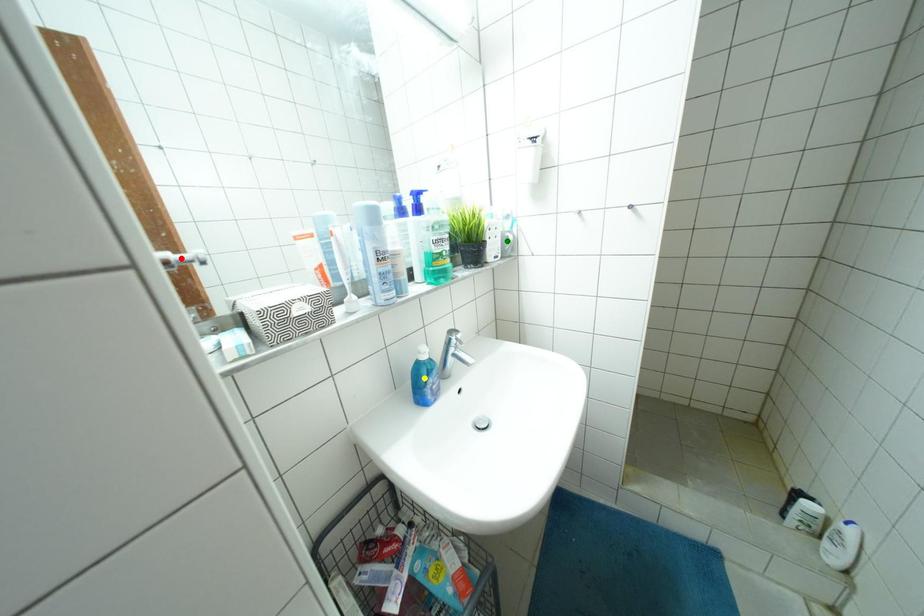
Order these from nearest to farthest:
yellow point
red point
green point

red point → yellow point → green point